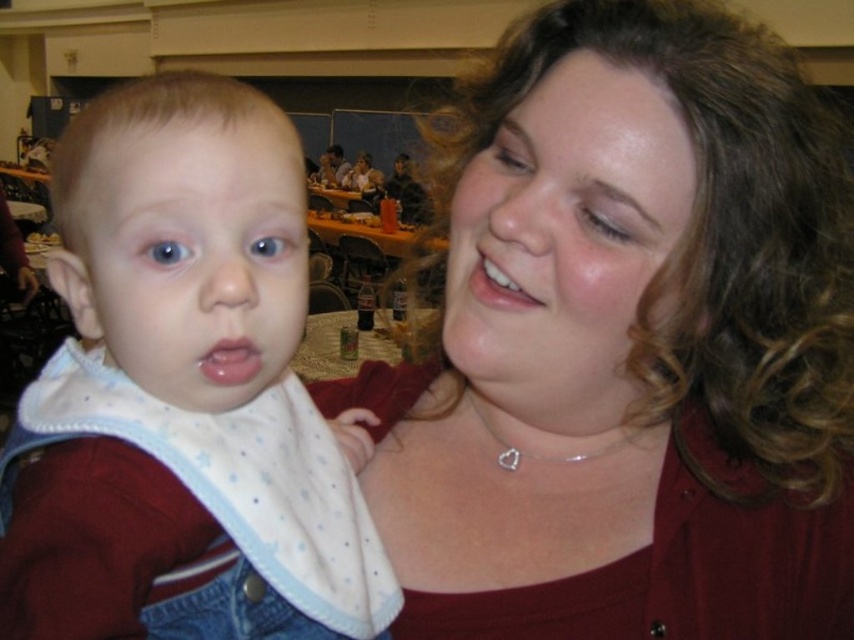
You are standing in the social gathering and see the point at coordinates (627,344). Which object is this point located on?

The point at coordinates (627,344) is located on the matte red shirt at center.

Looking at this image, you are a photographer at an indoor event and need to adjust the lighting between the matte red shirt at center and the white dotted bib at left. Which object should you focus on first if you want to start with the one closer to the left edge of the frame?

The white dotted bib at left is positioned to the left of the matte red shirt at center, so you should focus on the white dotted bib at left first since it is closer to the left edge of the frame.